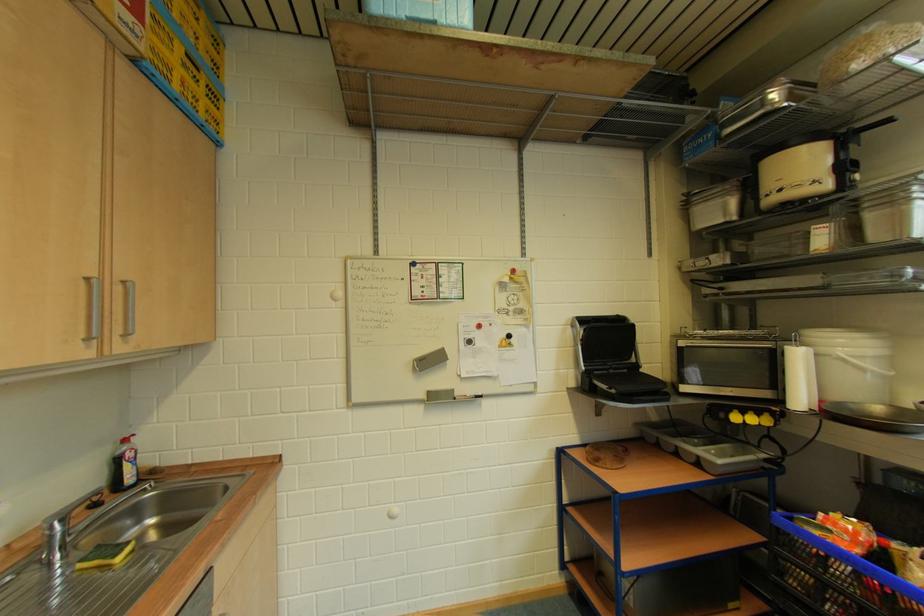
Identify the location of oven door handle. This screenshot has height=616, width=924. (728, 344).